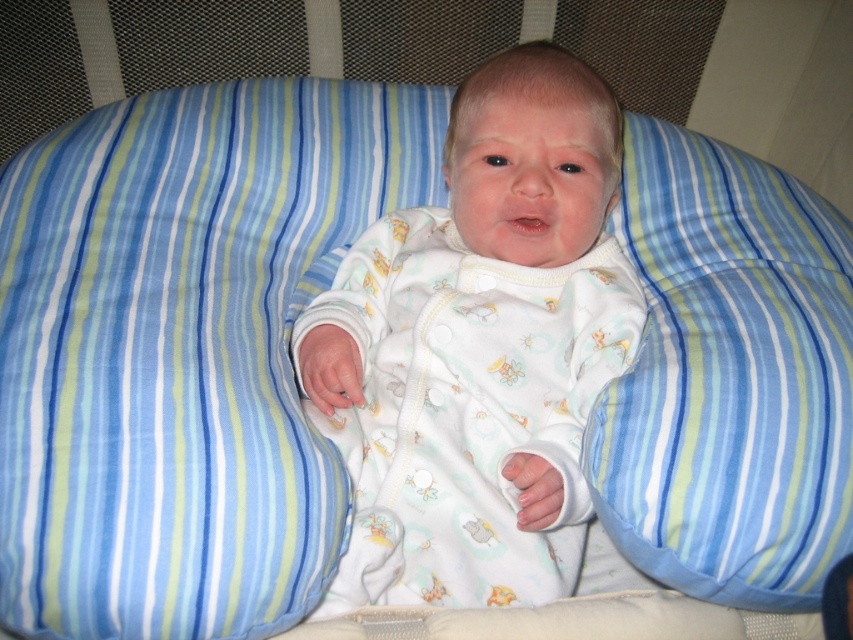
Can you confirm if white soft fabric baby at center is positioned above blue striped pillow at center?

Indeed, white soft fabric baby at center is positioned over blue striped pillow at center.

From the picture: Does white soft fabric baby at center appear on the left side of blue striped pillow at center?

Yes, white soft fabric baby at center is to the left of blue striped pillow at center.

Find the location of `white soft fabric baby at center`. white soft fabric baby at center is located at coordinates (479, 348).